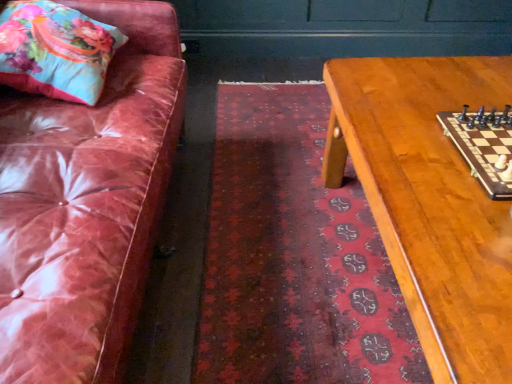
Question: Is point (470, 362) closer or farther from the camera than point (483, 182)?

Choices:
 (A) closer
 (B) farther

Answer: (A)

Question: From a real-world perspective, relative to wooden chessboard at right, is wooden chessboard at center vertically above or below?

Choices:
 (A) above
 (B) below

Answer: (B)

Question: Based on their relative distances, which object is farther from the dark red textured rug at center?

Choices:
 (A) floral fabric pillow at upper left
 (B) wooden chessboard at right
 (C) wooden chessboard at center

Answer: (A)

Question: Which of these objects is positioned closest to the wooden chessboard at center?

Choices:
 (A) dark red textured rug at center
 (B) wooden chessboard at right
 (C) floral fabric pillow at upper left

Answer: (B)